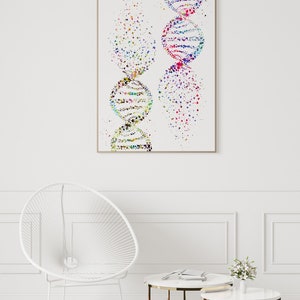
I want to click on individual strings in the chair, so click(x=105, y=210), click(x=107, y=214), click(x=109, y=217), click(x=111, y=219).